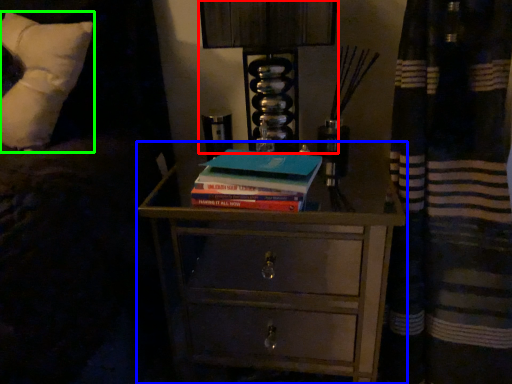
Question: Which object is the farthest from bedside lamp (highlighted by a red box)? Choose among these: chest of drawers (highlighted by a blue box) or pillow (highlighted by a green box).

Choices:
 (A) chest of drawers
 (B) pillow

Answer: (B)